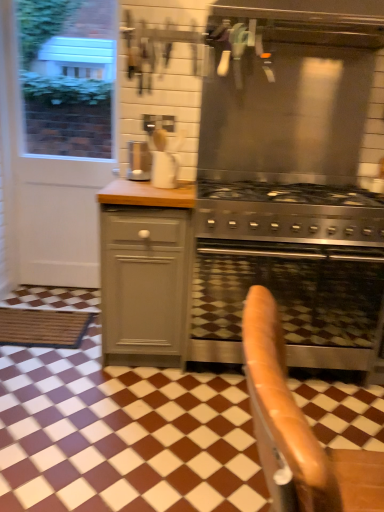
Locate an element on the screen. vacant space to the left of matte gray cabinet at center-left is located at coordinates (47, 362).